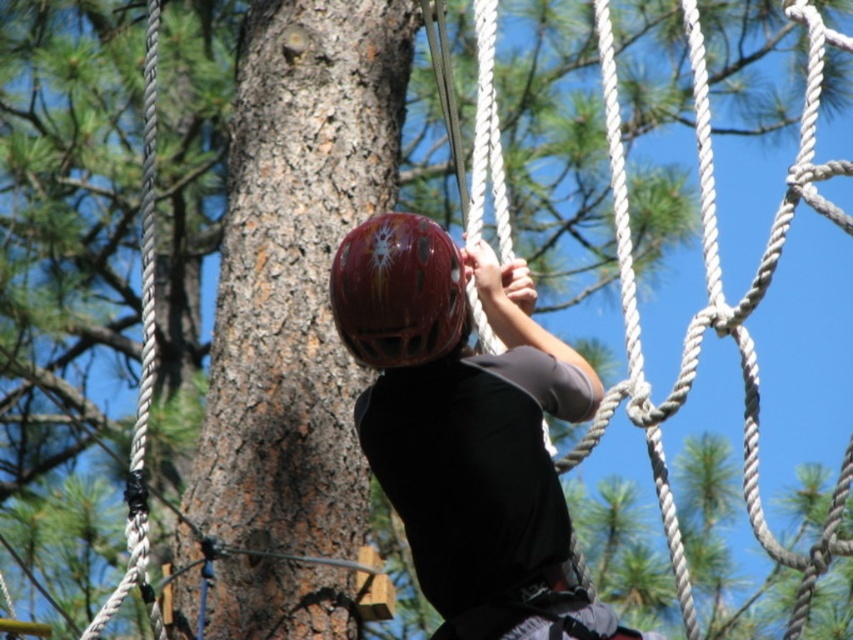
Question: Can you confirm if shiny red helmet at center is thinner than glossy red helmet at center?

Choices:
 (A) yes
 (B) no

Answer: (B)

Question: In this image, where is shiny red helmet at center located relative to glossy red helmet at center?

Choices:
 (A) below
 (B) above

Answer: (A)

Question: Is shiny red helmet at center to the right of glossy red helmet at center from the viewer's perspective?

Choices:
 (A) no
 (B) yes

Answer: (B)

Question: Which point appears closest to the camera in this image?

Choices:
 (A) (390, 356)
 (B) (463, 612)

Answer: (B)

Question: Which point appears closest to the camera in this image?

Choices:
 (A) (442, 244)
 (B) (473, 580)

Answer: (B)